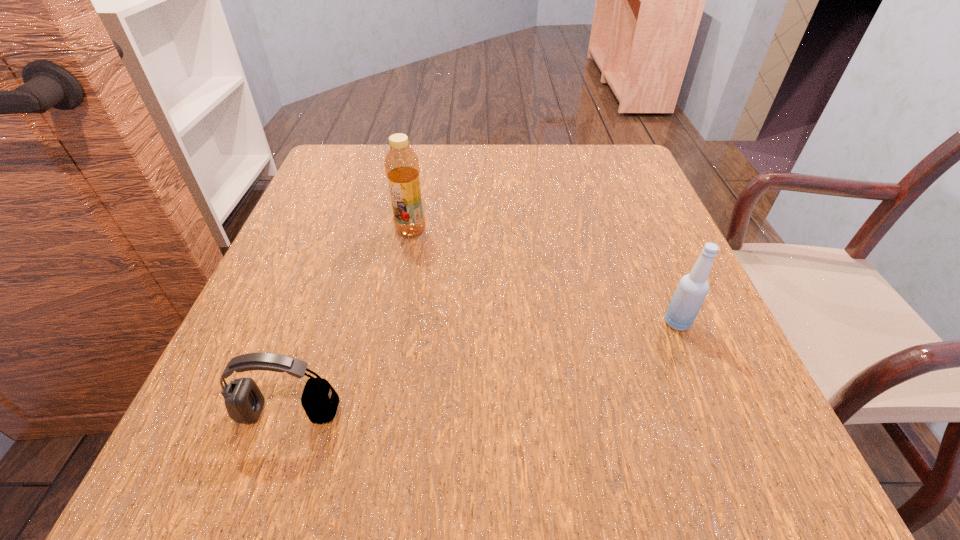
The height and width of the screenshot is (540, 960). I want to click on the farthest object, so click(401, 163).

You are a GUI agent. You are given a task and a screenshot of the screen. Output one action in this format:
    pyautogui.click(x=<x>, y=<y>)
    Task: Click on the second object from right to left
    
    Given the screenshot: What is the action you would take?
    pyautogui.click(x=401, y=163)

Locate an element on the screen. The height and width of the screenshot is (540, 960). the right bottle is located at coordinates (692, 289).

The height and width of the screenshot is (540, 960). What are the coordinates of `the second shortest object` in the screenshot? It's located at (692, 289).

Image resolution: width=960 pixels, height=540 pixels. Identify the location of the leftmost object. (244, 401).

Find the location of a particular element. This screenshot has height=540, width=960. the shortest object is located at coordinates (244, 401).

Where is `free location located on the front of the tallest object`? free location located on the front of the tallest object is located at coordinates (400, 287).

You are a GUI agent. You are given a task and a screenshot of the screen. Output one action in this format:
    pyautogui.click(x=<x>, y=<y>)
    Task: Click on the free space located 0.120m on the left of the second tallest object
    
    Given the screenshot: What is the action you would take?
    pyautogui.click(x=590, y=322)

This screenshot has width=960, height=540. What are the coordinates of `vacant region located on the headband of the nearest object` in the screenshot? It's located at click(x=272, y=463).

Identify the location of object present at the left edge. (244, 401).